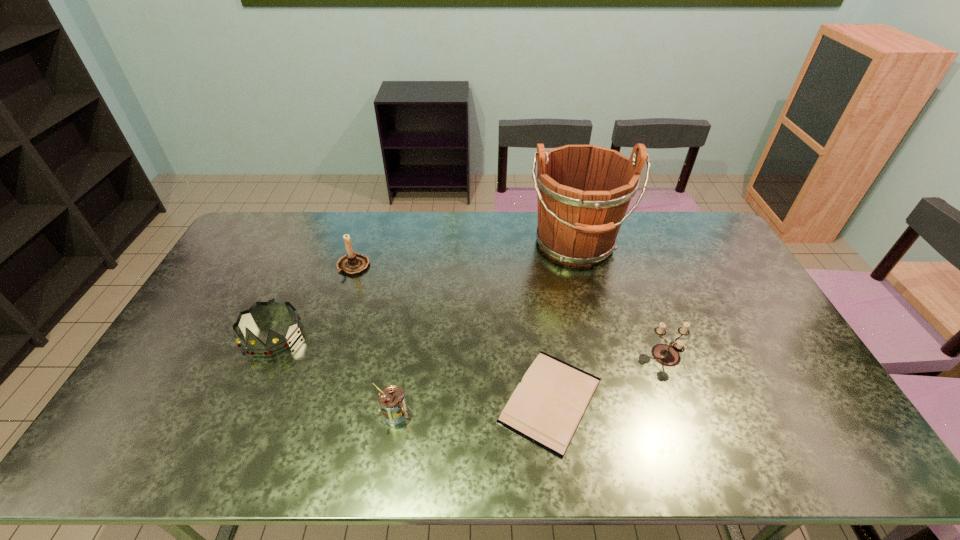
In order to click on the tallest object in this screenshot , I will do `click(583, 191)`.

Identify the location of the farther candle holder. (352, 263).

You are a GUI agent. You are given a task and a screenshot of the screen. Output one action in this format:
    pyautogui.click(x=<x>, y=<y>)
    Task: Click on the fifth object from right to left
    
    Given the screenshot: What is the action you would take?
    pyautogui.click(x=352, y=263)

Locate an element on the screen. The width and height of the screenshot is (960, 540). the leftmost object is located at coordinates click(x=275, y=343).

Identify the location of the shorter candle holder. (668, 355).

Find the location of a particular element. The image size is (960, 540). the right candle holder is located at coordinates (668, 355).

Image resolution: width=960 pixels, height=540 pixels. I want to click on can, so click(391, 399).

The height and width of the screenshot is (540, 960). Identify the location of the shortest object. (546, 408).

Locate an element on the screen. This screenshot has width=960, height=540. free spot located with the handle on the side of the tallest object is located at coordinates (608, 377).

Image resolution: width=960 pixels, height=540 pixels. Find the location of `vacant region located 0.200m on the back of the farther candle holder`. vacant region located 0.200m on the back of the farther candle holder is located at coordinates (368, 222).